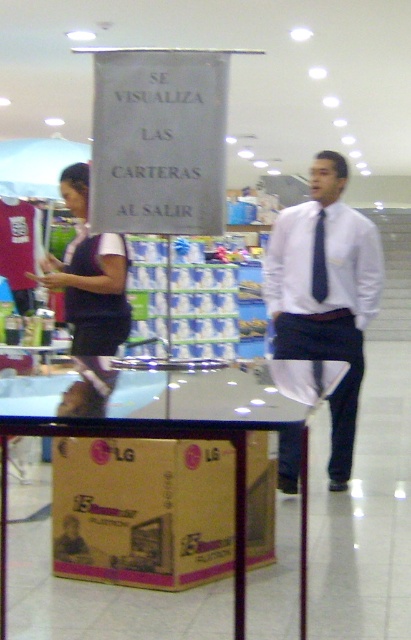
You are a customer at a store and see the gold cardboard lg tv box at center and the black silk tie at center on a table. Which object is taller?

The gold cardboard lg tv box at center is taller than the black silk tie at center.

You are a delivery person who needs to place a new gold cardboard lg tv box at center on the table. The table has a reflective surface. Where should you place the new box so that its reflection matches the existing one at point 0.798, 0.348?

Place the new gold cardboard lg tv box at center exactly at point (143, 509) on the table to ensure its reflection matches the existing one.

You are a store employee organizing items on a table. You have a gold cardboard lg tv box at center and a white satin dress shirt at center. Which item takes up more horizontal space on the table?

The gold cardboard lg tv box at center has a greater width than the white satin dress shirt at center, so it takes up more horizontal space on the table.